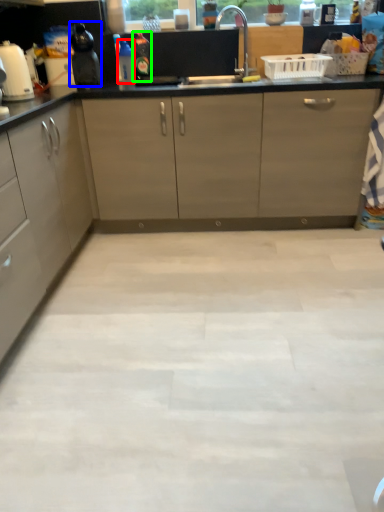
Question: Estimate the real-world distances between objects in this image. Which object is farther from bottle (highlighted by a red box), kitchen appliance (highlighted by a blue box) or bottle (highlighted by a green box)?

Choices:
 (A) kitchen appliance
 (B) bottle

Answer: (A)